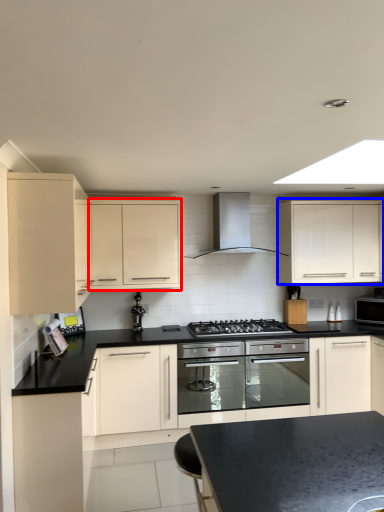
Question: Which of the following is the closest to the observer, cabinetry (highlighted by a red box) or cabinetry (highlighted by a blue box)?

Choices:
 (A) cabinetry
 (B) cabinetry

Answer: (A)